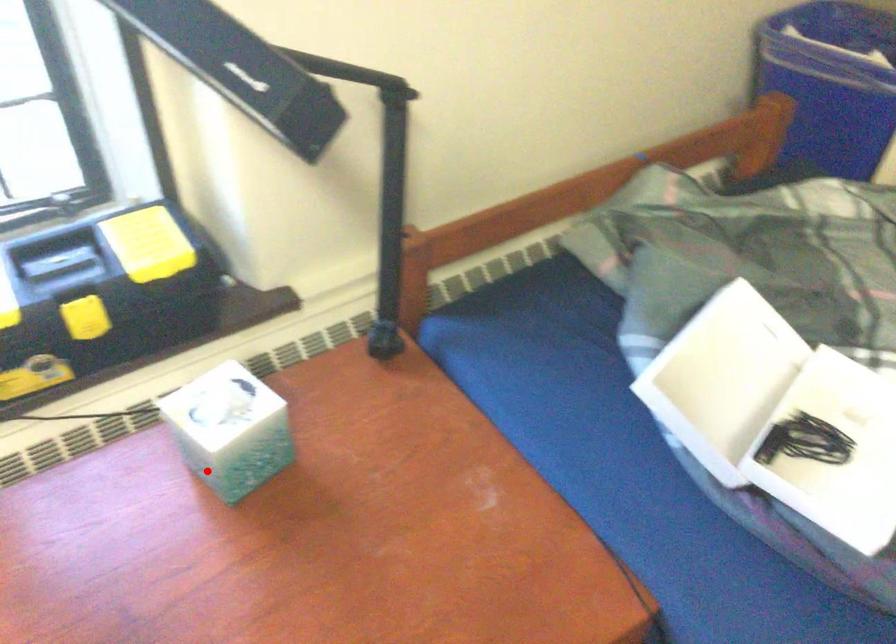
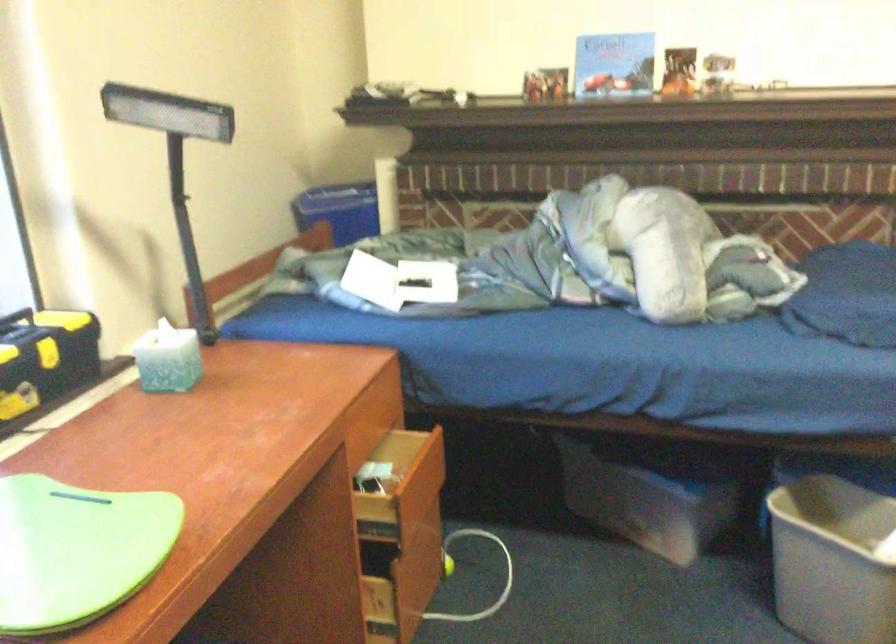
Question: I am providing you with two images of the same scene from different viewpoints. A red point is shown in image1. For the corresponding object point in image2, is it positioned nearer or farther from the camera?

Choices:
 (A) Nearer
 (B) Farther

Answer: (B)